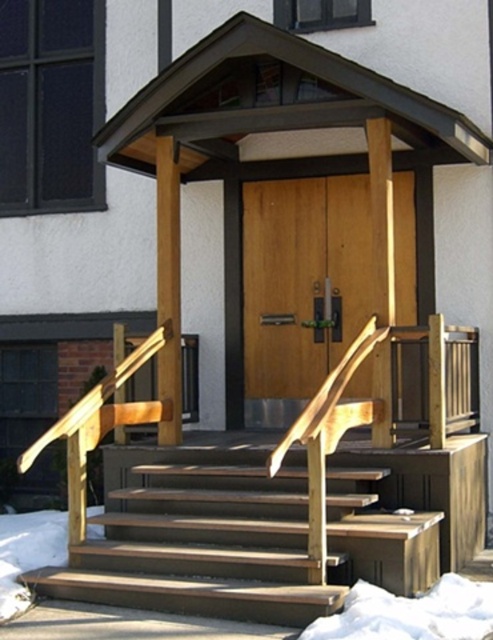
Who is shorter, wooden stairs at center or wooden at center?

wooden stairs at center is shorter.

Where is `wooden stairs at center`? wooden stairs at center is located at coordinates (211, 534).

Find the location of a particular element. wooden stairs at center is located at coordinates (211, 534).

Is brown wood porch at center bigger than wooden at center?

Correct, brown wood porch at center is larger in size than wooden at center.

Based on the photo, does brown wood porch at center appear on the right side of wooden at center?

No, brown wood porch at center is not to the right of wooden at center.

Which is in front, point (236, 563) or point (408, 289)?

Point (236, 563) is more forward.

Where is `brown wood porch at center`? The image size is (493, 640). brown wood porch at center is located at coordinates (267, 499).

Who is positioned more to the left, brown wood porch at center or wooden stairs at center?

Positioned to the left is wooden stairs at center.

Who is more distant from viewer, (288, 492) or (329, 589)?

Point (288, 492)

Locate an element on the screen. The image size is (493, 640). brown wood porch at center is located at coordinates (267, 499).